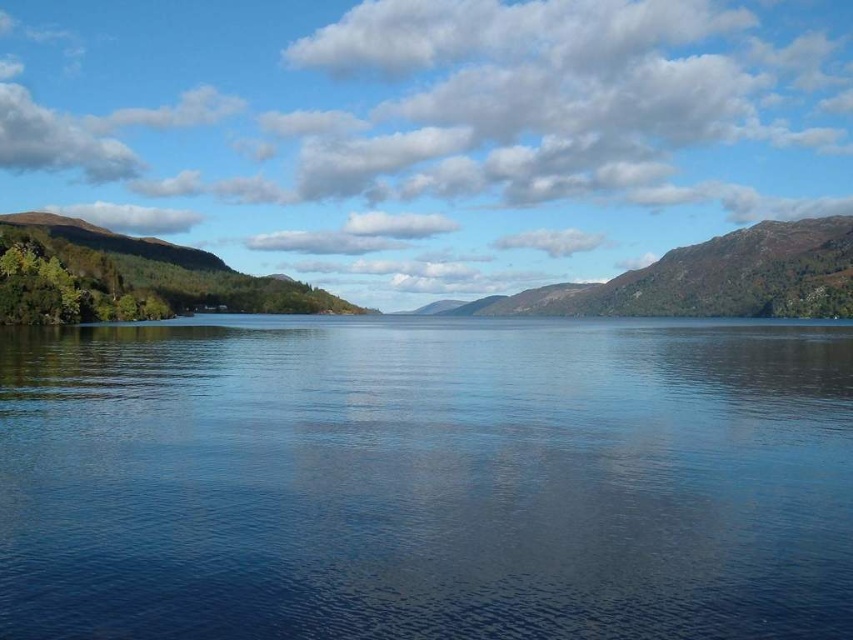
Is transparent water at center thinner than green mossy rock at center?

Correct, transparent water at center's width is less than green mossy rock at center's.

Can you confirm if transparent water at center is positioned above green mossy rock at center?

No, transparent water at center is not above green mossy rock at center.

The height and width of the screenshot is (640, 853). Describe the element at coordinates (426, 481) in the screenshot. I see `transparent water at center` at that location.

At what (x,y) coordinates should I click in order to perform the action: click on transparent water at center. Please return your answer as a coordinate pair (x, y). Looking at the image, I should click on point(426,481).

Is point (115, 301) closer to camera compared to point (688, 312)?

Yes, it is in front of point (688, 312).

Based on the photo, who is taller, green textured hillside at left or green mossy rock at center?

Standing taller between the two is green mossy rock at center.

Is point (238, 307) more distant than point (836, 301)?

Yes, point (238, 307) is behind point (836, 301).

What are the coordinates of `green textured hillside at left` in the screenshot? It's located at (129, 276).

What do you see at coordinates (426, 481) in the screenshot? The width and height of the screenshot is (853, 640). I see `transparent water at center` at bounding box center [426, 481].

Is the position of transparent water at center more distant than that of green textured hillside at left?

No, transparent water at center is in front of green textured hillside at left.

Is point (720, 451) behind point (71, 250)?

No.

Find the location of a particular element. transparent water at center is located at coordinates (426, 481).